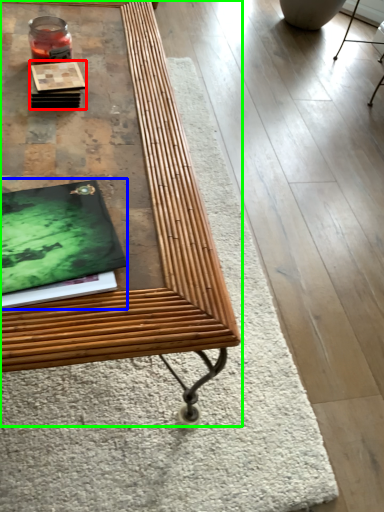
Question: Which object is positioned farthest from book (highlighted by a red box)? Select from magazine (highlighted by a blue box) and table (highlighted by a green box).

Choices:
 (A) magazine
 (B) table

Answer: (A)